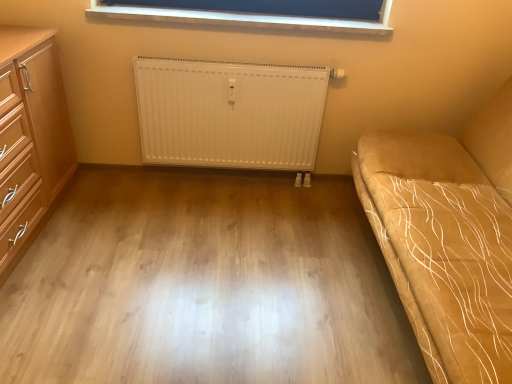
The width and height of the screenshot is (512, 384). I want to click on vacant space situated on the left part of white ribbed radiator at center, so click(x=129, y=199).